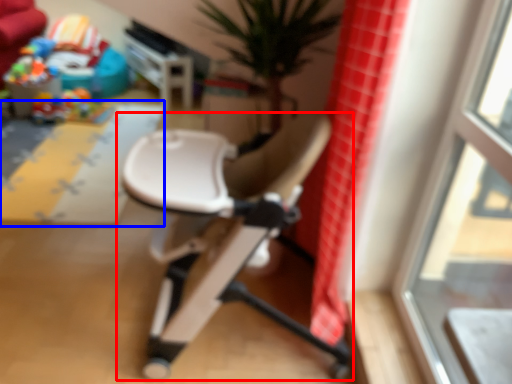
Question: Which object is further to the camera taking this photo, chair (highlighted by a red box) or plain (highlighted by a blue box)?

Choices:
 (A) chair
 (B) plain

Answer: (B)